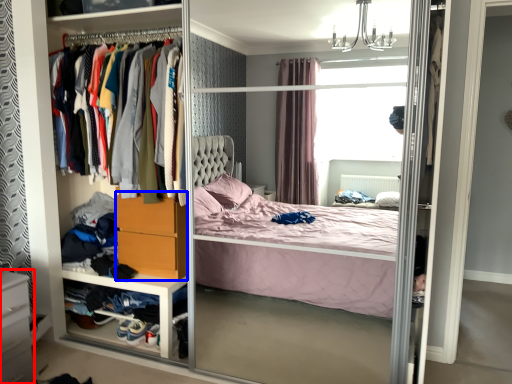
Question: Among these objects, which one is farthest to the camera, vanity (highlighted by a red box) or dresser (highlighted by a blue box)?

Choices:
 (A) vanity
 (B) dresser

Answer: (B)